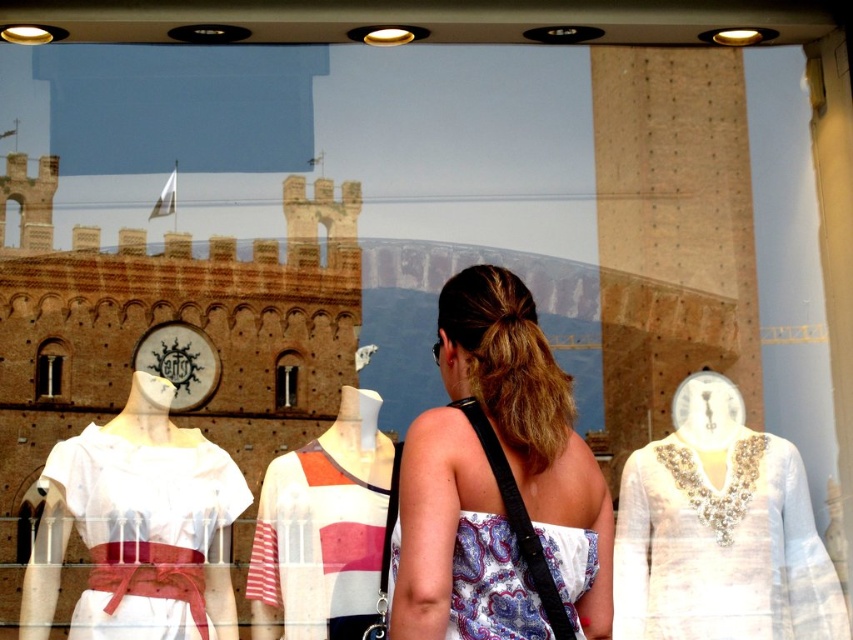
You are standing in front of the shop window and want to touch the dress in the center. The shop has a strict policy that only allows touching items within a 0.5 unit radius from the center of the window. Can you touch the dress at point (498,484)?

The point (498,484) is 0.259 units away from the center of the window. Since it is within the 0.5 unit radius, you can touch the dress at point (498,484).

You are a customer in the store looking at the shop window display. You see the paisley fabric dress at center and the striped cotton dress at center. Which dress is positioned to the right of the other?

The paisley fabric dress at center is to the right of the striped cotton dress at center.

You are a customer in the shop and want to see both the paisley fabric dress at center and the white fabric dress at center. Which dress is positioned lower in the window display?

The paisley fabric dress at center is located below the white fabric dress at center, so it is positioned lower in the window display.